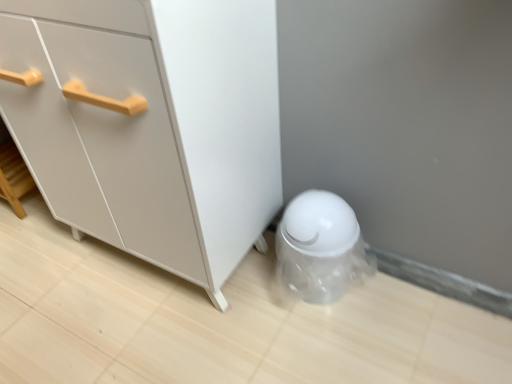
Locate an element on the screen. The width and height of the screenshot is (512, 384). free space in front of transparent plastic trash can at lower right is located at coordinates (327, 338).